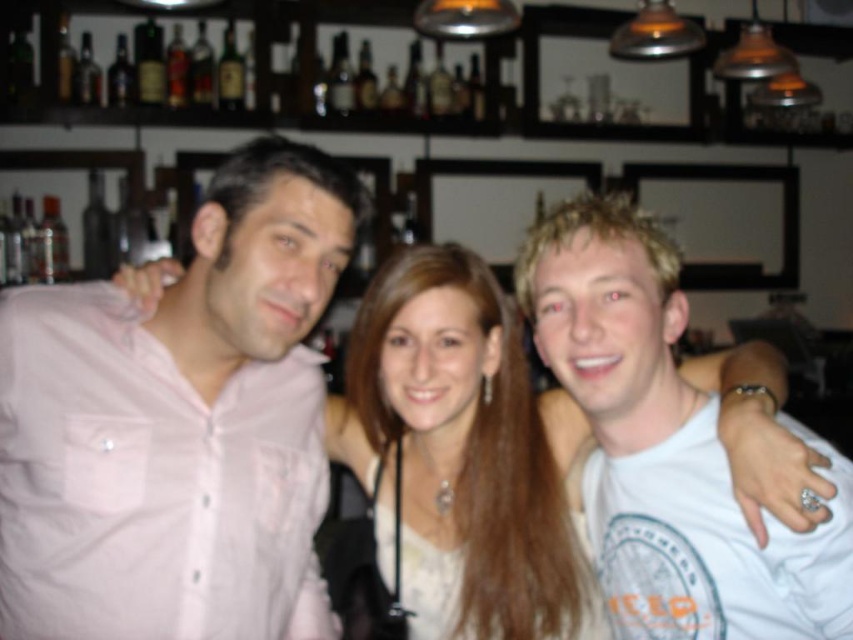
Does pink cotton shirt at left appear on the right side of matte white shirt at center?

Incorrect, pink cotton shirt at left is not on the right side of matte white shirt at center.

Is point (10, 536) farther from camera compared to point (427, 385)?

That is False.

Between point (276, 205) and point (495, 429), which one is positioned in front?

Positioned in front is point (276, 205).

This screenshot has width=853, height=640. What are the coordinates of `pink cotton shirt at left` in the screenshot? It's located at (178, 424).

In the scene shown: Is the position of pink cotton shirt at left more distant than that of white cotton t-shirt at center?

Yes.

How much distance is there between pink cotton shirt at left and white cotton t-shirt at center?

pink cotton shirt at left is 17.71 inches away from white cotton t-shirt at center.

Describe the element at coordinates (178, 424) in the screenshot. This screenshot has width=853, height=640. I see `pink cotton shirt at left` at that location.

The width and height of the screenshot is (853, 640). What are the coordinates of `pink cotton shirt at left` in the screenshot? It's located at (178, 424).

Based on the photo, can you confirm if white cotton t-shirt at center is taller than matte white shirt at center?

Indeed, white cotton t-shirt at center has a greater height compared to matte white shirt at center.

Can you confirm if white cotton t-shirt at center is smaller than matte white shirt at center?

Indeed, white cotton t-shirt at center has a smaller size compared to matte white shirt at center.

Locate an element on the screen. The image size is (853, 640). white cotton t-shirt at center is located at coordinates (666, 445).

Find the location of a particular element. This screenshot has height=640, width=853. white cotton t-shirt at center is located at coordinates (666, 445).